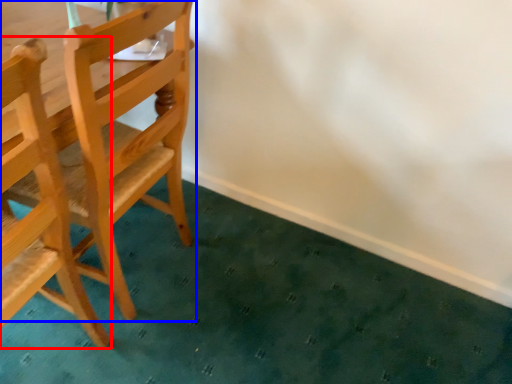
Question: Which of the following is the farthest to the observer, chair (highlighted by a red box) or chair (highlighted by a blue box)?

Choices:
 (A) chair
 (B) chair

Answer: (B)